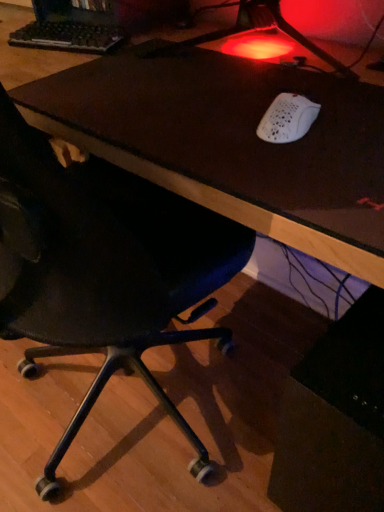
Identify the location of spots to the right of black plastic keyboard at upper left. (153, 42).